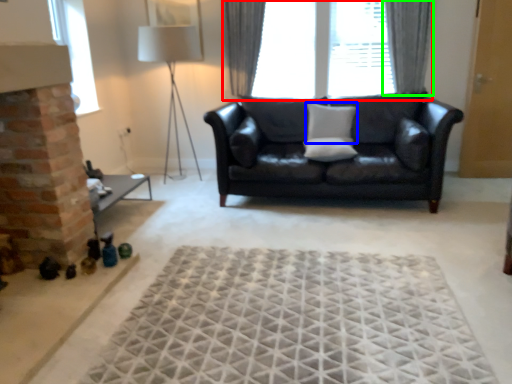
Question: Estimate the real-world distances between objects in this image. Which object is farther from window (highlighted by a red box), pillow (highlighted by a blue box) or curtain (highlighted by a green box)?

Choices:
 (A) pillow
 (B) curtain

Answer: (B)